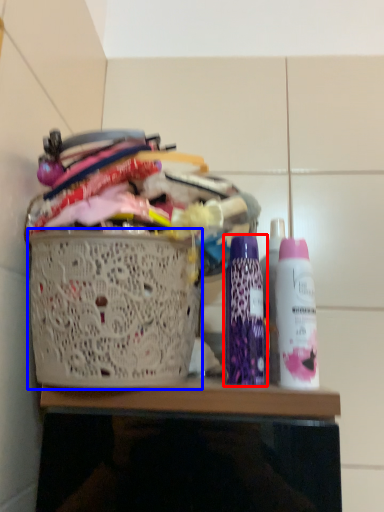
Question: Which object is further to the camera taking this photo, bottle (highlighted by a red box) or basket (highlighted by a blue box)?

Choices:
 (A) bottle
 (B) basket

Answer: (A)